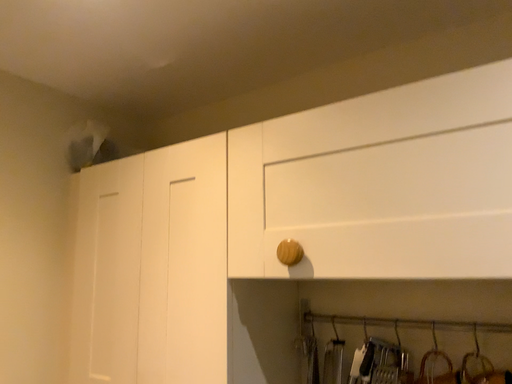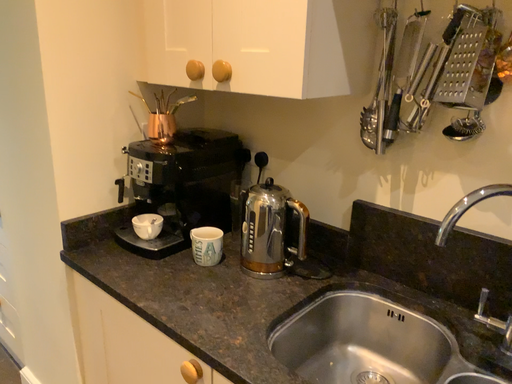
Question: How did the camera likely rotate when shooting the video?

Choices:
 (A) rotated left
 (B) rotated right

Answer: (A)